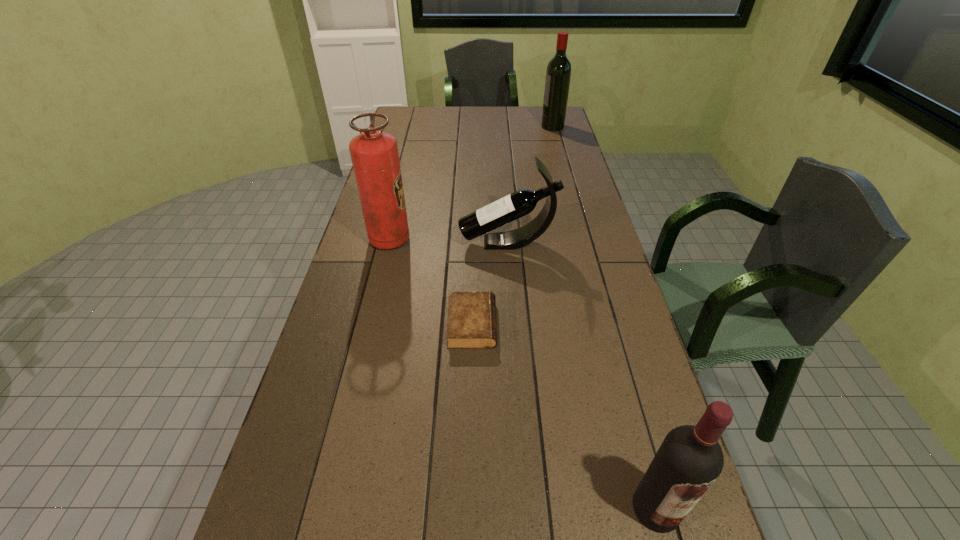
This screenshot has height=540, width=960. Find the location of `vacant area situated on the label of the farthest wine bottle`. vacant area situated on the label of the farthest wine bottle is located at coordinates (481, 126).

Where is `vacant area located on the stand of the leftmost wine bottle`? This screenshot has height=540, width=960. vacant area located on the stand of the leftmost wine bottle is located at coordinates (396, 243).

The height and width of the screenshot is (540, 960). Identify the location of blank space located on the stand of the leftmost wine bottle. (438, 243).

The width and height of the screenshot is (960, 540). In order to click on free space located 0.300m on the stand of the leftmost wine bottle in this screenshot , I will do `click(370, 243)`.

Where is `vacant space located 0.110m on the spine side of the second nearest object`? The image size is (960, 540). vacant space located 0.110m on the spine side of the second nearest object is located at coordinates (536, 325).

Locate an element on the screen. The height and width of the screenshot is (540, 960). object at the far edge is located at coordinates (558, 74).

You are a GUI agent. You are given a task and a screenshot of the screen. Output one action in this format:
    pyautogui.click(x=<x>, y=<y>)
    Task: Click on the object that is positioned at the left edge
    The width and height of the screenshot is (960, 540).
    Given the screenshot: What is the action you would take?
    pyautogui.click(x=374, y=154)

Find the location of a particular element. The image size is (960, 540). object present at the far right corner is located at coordinates (558, 74).

The image size is (960, 540). Identify the location of vacant region at the far edge. (448, 110).

This screenshot has height=540, width=960. I want to click on free region at the left edge, so click(330, 537).